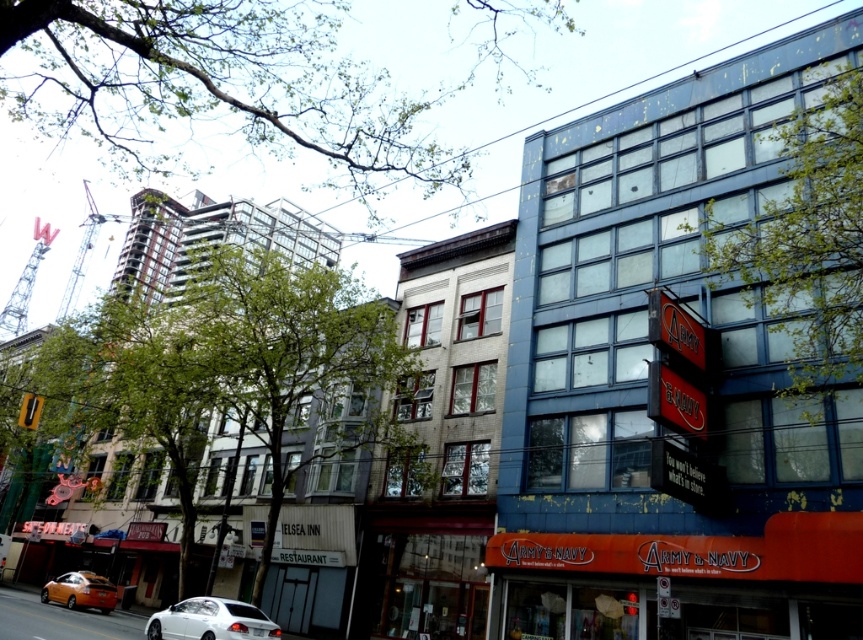
You are standing on the street looking at the scene. There is a point labeled as point (210, 620). What object is this point located on?

The point (210, 620) is located on the white glossy sedan at lower center.

You are a delivery driver needing to park your vehicle in the parking lot behind the buildings. The parking spot you need is at coordinate point 0.970, 0.244. Is the white glossy sedan at lower center blocking your parking spot?

The white glossy sedan at lower center is located at point (210, 620), so it is directly occupying the parking spot you need. You will not be able to park there without moving the sedan.